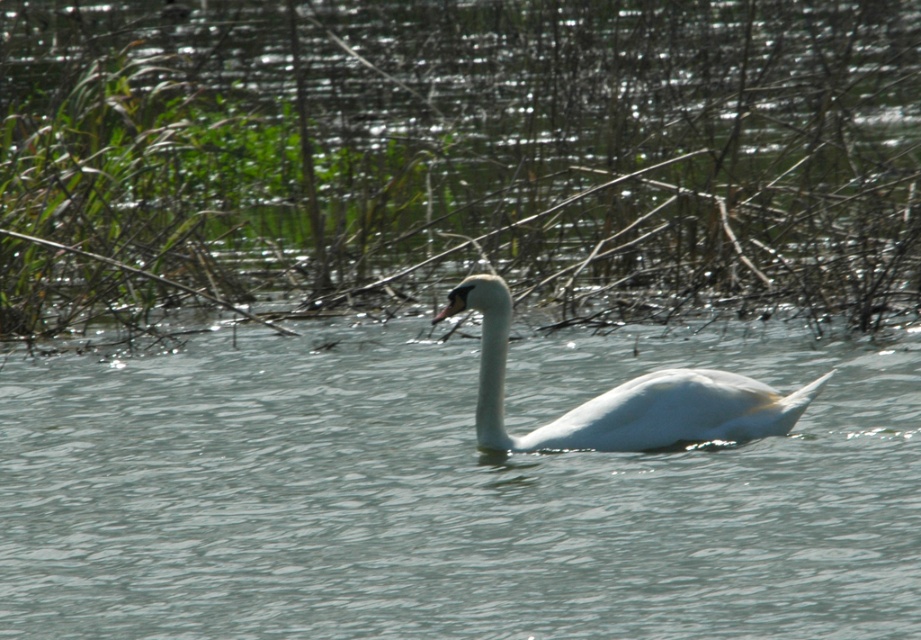
Can you confirm if clear water at center is smaller than white glossy swan at center?

Actually, clear water at center might be larger than white glossy swan at center.

How much distance is there between clear water at center and white glossy swan at center?

A distance of 26.91 inches exists between clear water at center and white glossy swan at center.

Does point (357, 490) come closer to viewer compared to point (647, 397)?

No.

Where is `clear water at center`? The image size is (921, 640). clear water at center is located at coordinates (449, 493).